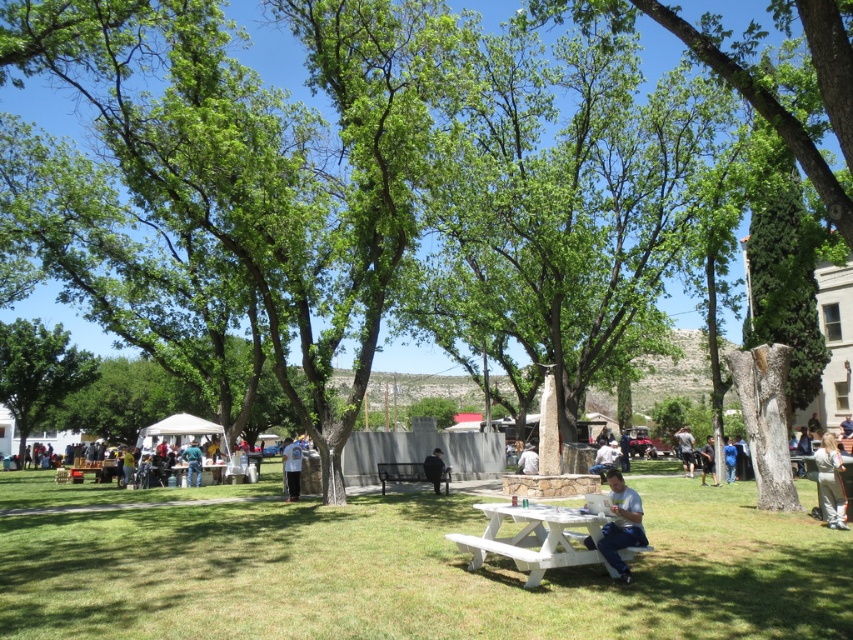
Between green leafy tree at left and white cotton shirt at center, which one appears on the right side from the viewer's perspective?

white cotton shirt at center

Between green leafy tree at left and white cotton shirt at center, which one has less height?

Standing shorter between the two is white cotton shirt at center.

Find the location of a particular element. The width and height of the screenshot is (853, 640). green leafy tree at left is located at coordinates (38, 372).

Is metallic black bench at center bigger than white fabric bag at center?

Actually, metallic black bench at center might be smaller than white fabric bag at center.

Is point (405, 481) closer to viewer compared to point (531, 461)?

No.

What do you see at coordinates (398, 472) in the screenshot? I see `metallic black bench at center` at bounding box center [398, 472].

Image resolution: width=853 pixels, height=640 pixels. In order to click on metallic black bench at center in this screenshot , I will do `click(398, 472)`.

Can you confirm if green grass at lower center is positioned above black fabric bag at lower right?

Actually, green grass at lower center is below black fabric bag at lower right.

Is green grass at lower center further to camera compared to black fabric bag at lower right?

No.

Does point (233, 636) come closer to viewer compared to point (709, 460)?

Yes.

The height and width of the screenshot is (640, 853). I want to click on green grass at lower center, so click(415, 572).